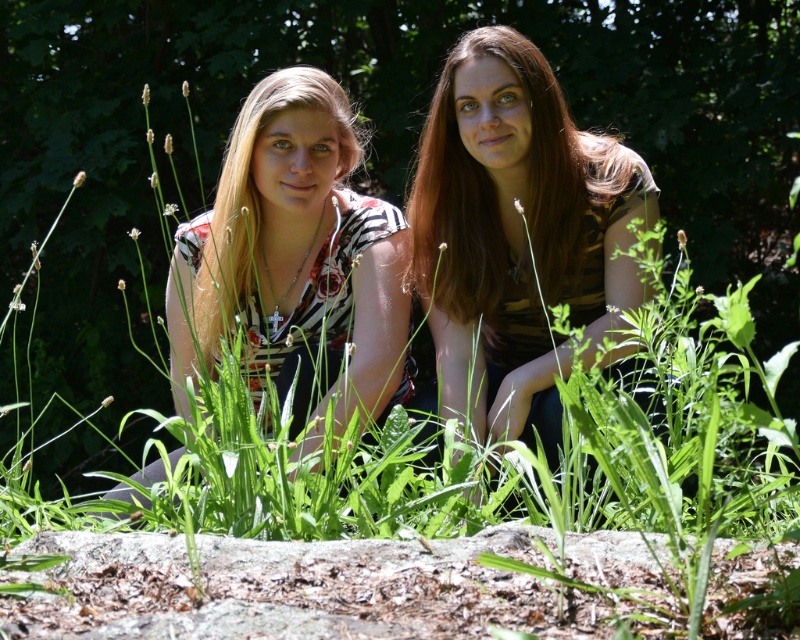
You are a photographer trying to capture a photo of both the brown striped shirt at center and the matte floral blouse at center. Based on their positions, which clothing item should you focus on first to ensure both are in frame?

The brown striped shirt at center is to the right of the matte floral blouse at center, so you should focus on the matte floral blouse at center first to ensure both are in frame.

You are standing in a forest and see two points marked in the image. The first point is labeled as point [460,108] and the second is point [198,225]. Which point is closer to you?

Point [460,108] is in front of point [198,225], so it is closer to you.